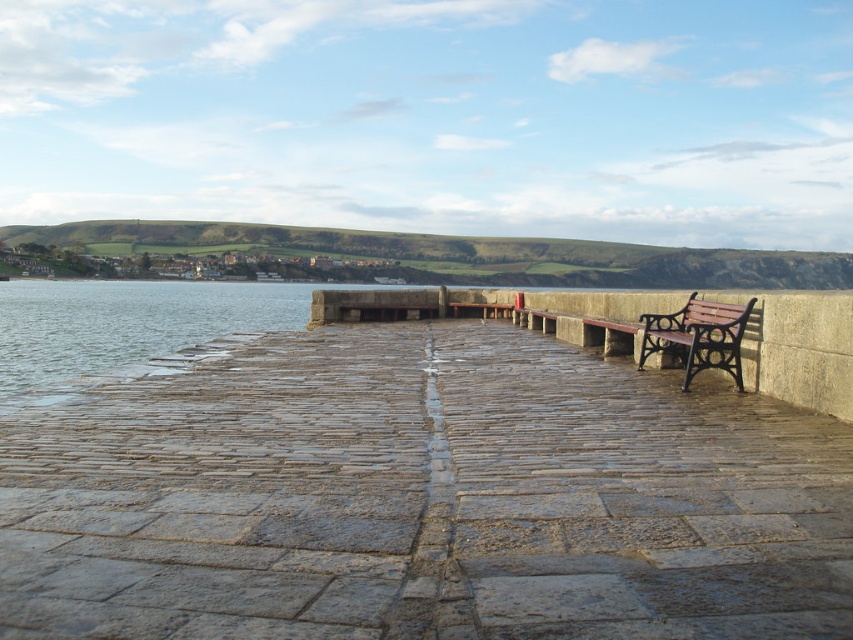
You are standing at the edge of the stone walkway in the waterfront scene. There is a point marked at coordinates point (155, 480). Can you estimate how far this point is from your current position?

The point (155, 480) is 5.11 meters away from the viewer, so the distance is approximately 5.11 meters.

You are a delivery robot with a 1.5 meter wide package. You need to move from the stone textured dock at center to the brown wooden bench at right. Is there enough space between them for your package?

The stone textured dock at center is 5.21 meters away from the brown wooden bench at right, so yes, the delivery robot can move the 1.5 meter wide package between them since the distance is sufficient.

You are a photographer wanting to capture the brown wooden bench at right and the stone textured dock at center in the same frame. Based on their positions, which object should you focus on first if you want to include both in your shot?

The stone textured dock at center is below the brown wooden bench at right, so you should focus on the brown wooden bench at right first to ensure both are in the frame.